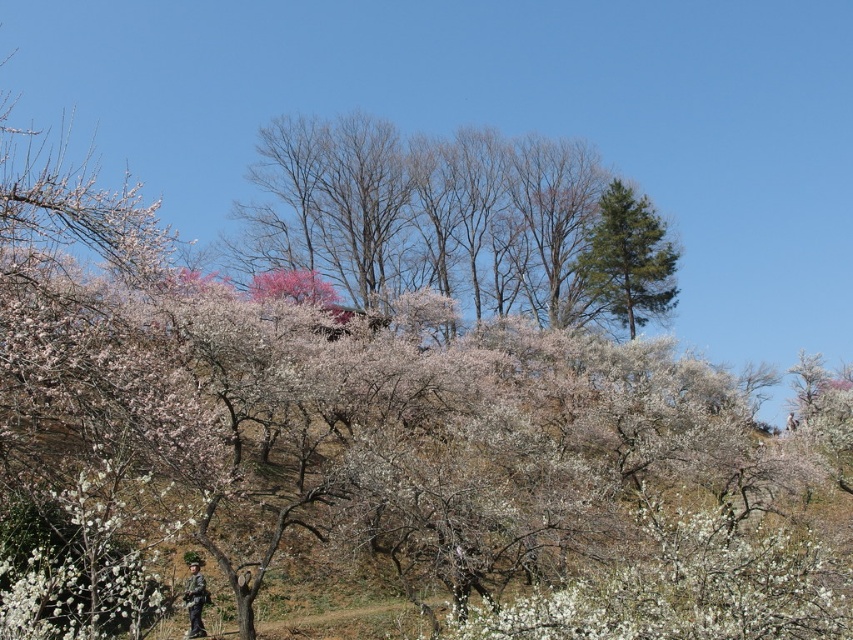
Is bare branches at upper center to the left of green needle-like tree at upper center from the viewer's perspective?

Correct, you'll find bare branches at upper center to the left of green needle-like tree at upper center.

Who is lower down, bare branches at upper center or green needle-like tree at upper center?

bare branches at upper center is below.

What do you see at coordinates (457, 221) in the screenshot? The image size is (853, 640). I see `bare branches at upper center` at bounding box center [457, 221].

The image size is (853, 640). I want to click on bare branches at upper center, so click(457, 221).